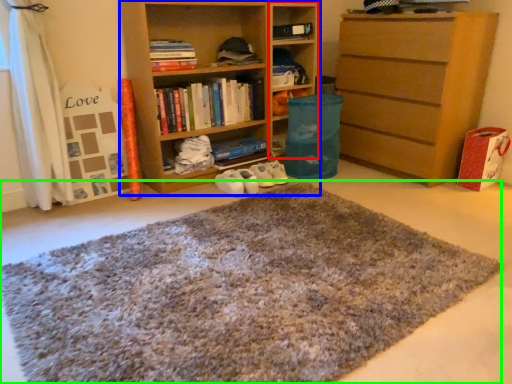
Question: Which object is the farthest from cabinet (highlighted by a red box)? Choose among these: shelf (highlighted by a blue box) or doormat (highlighted by a green box).

Choices:
 (A) shelf
 (B) doormat

Answer: (B)